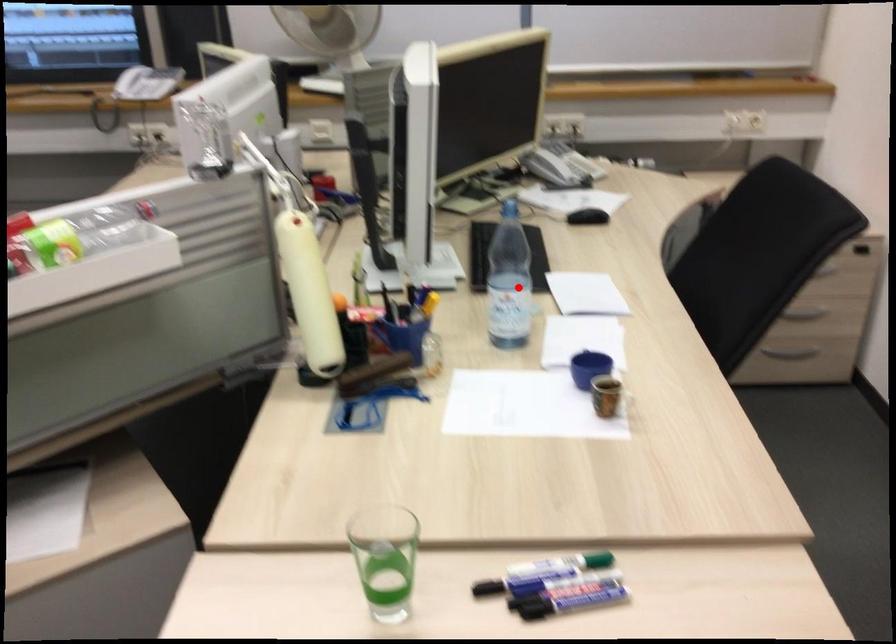
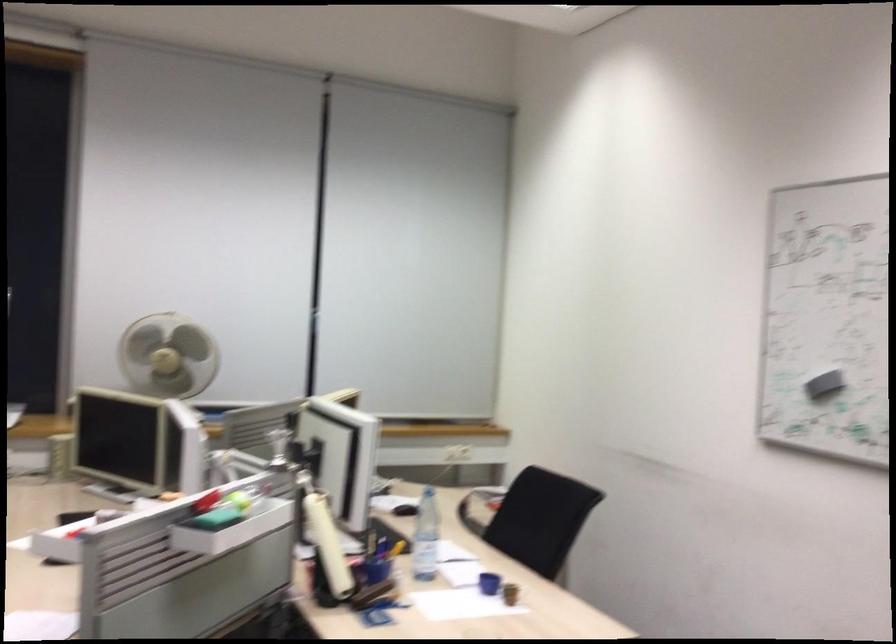
Question: I am providing you with two images of the same scene from different viewpoints. A red point is marked on the first image. At the location where the point appears in image 1, is it still visible in image 2?

Choices:
 (A) Yes
 (B) No

Answer: (A)